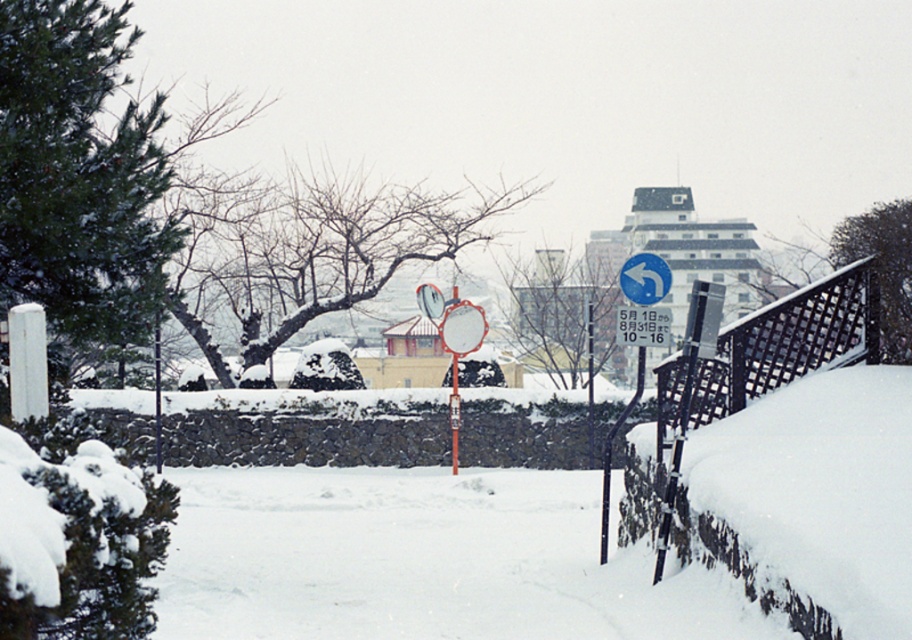
Based on the photo, measure the distance between blue circular sign at upper right and blue plastic sign at upper center.

A distance of 8.22 inches exists between blue circular sign at upper right and blue plastic sign at upper center.

Looking at this image, does blue circular sign at upper right appear on the right side of blue plastic sign at upper center?

Correct, you'll find blue circular sign at upper right to the right of blue plastic sign at upper center.

Is point (636, 282) closer to viewer compared to point (667, 340)?

No, (636, 282) is further to viewer.

The width and height of the screenshot is (912, 640). I want to click on blue circular sign at upper right, so click(x=644, y=278).